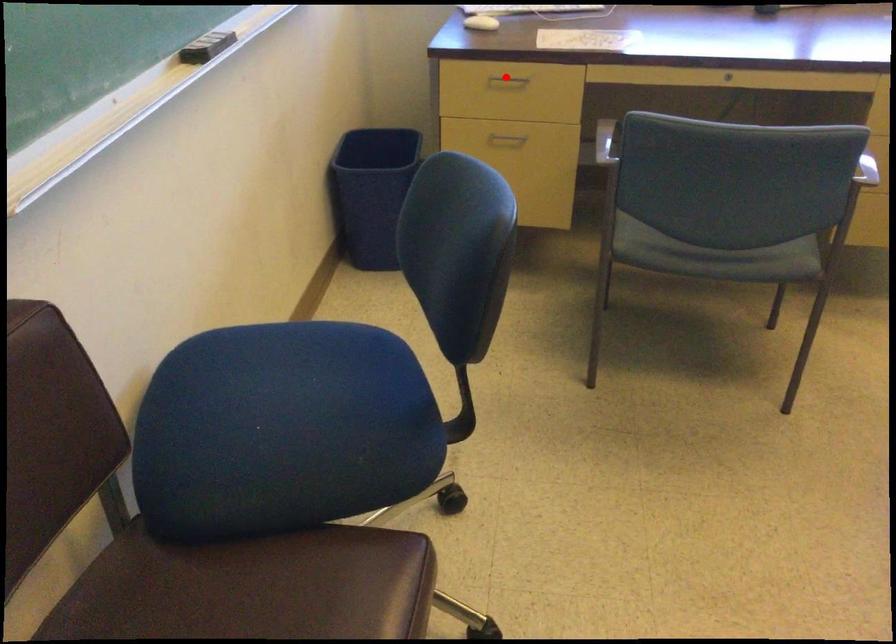
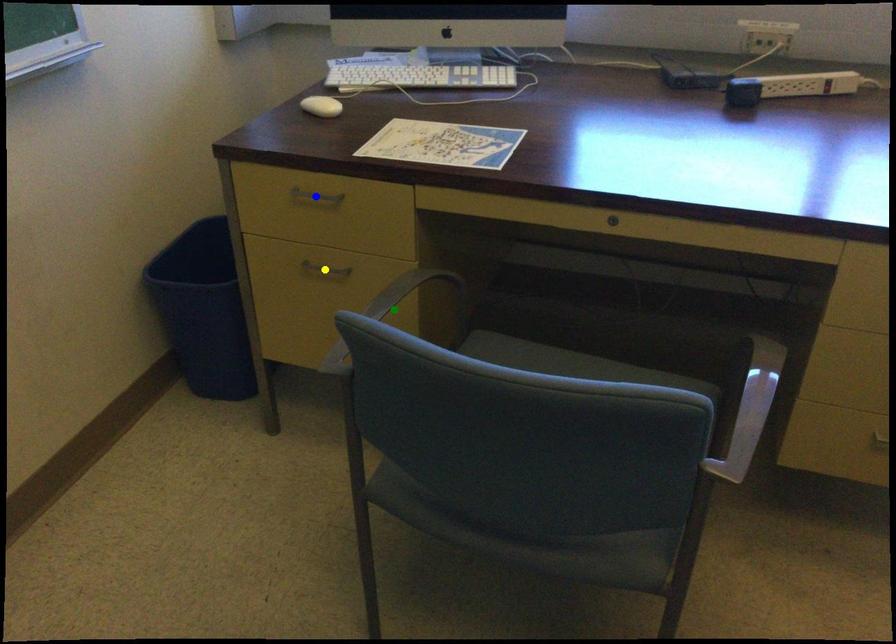
Question: I am providing you with two images of the same scene from different viewpoints. A red point is marked on the first image. You are given multiple points on the second image. In image 2, which mark is for the same physical point as the one in image 1?

Choices:
 (A) yellow point
 (B) green point
 (C) blue point

Answer: (C)